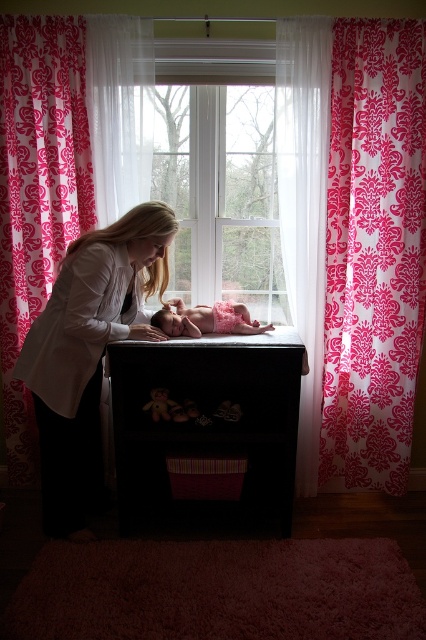
Question: Among these points, which one is farthest from the camera?

Choices:
 (A) (152, 401)
 (B) (118, 417)
 (C) (146, 205)
 (D) (371, 170)

Answer: (D)

Question: Does pink damask curtain at left have a larger size compared to matte white shirt at center?

Choices:
 (A) yes
 (B) no

Answer: (B)

Question: Which point appears closest to the camera in this image?

Choices:
 (A) (296, 77)
 (B) (175, 401)

Answer: (A)

Question: Considering the relative positions of clear glass window at center and velvety brown teddy bear at center in the image provided, where is clear glass window at center located with respect to velvety brown teddy bear at center?

Choices:
 (A) right
 (B) left

Answer: (A)

Question: Which of the following is the closest to the observer?

Choices:
 (A) (219, 396)
 (B) (271, 129)
 (C) (368, 216)

Answer: (C)

Question: Is pink damask curtain at right positioned in front of matte white shirt at center?

Choices:
 (A) no
 (B) yes

Answer: (A)